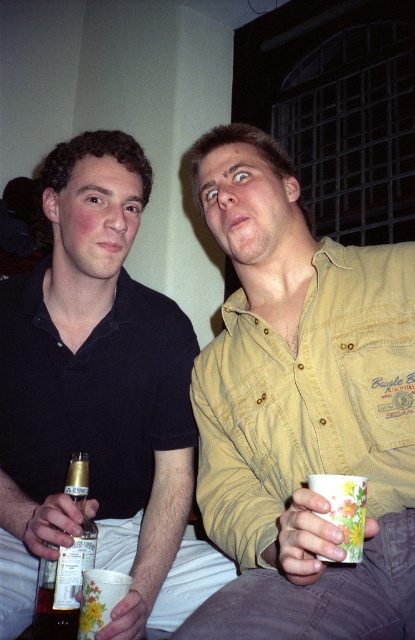
Question: Which object is farther from the camera taking this photo?

Choices:
 (A) yellow cotton shirt at upper right
 (B) gold foil beer bottle at lower left
 (C) matte black shirt at left

Answer: (B)

Question: Observing the image, what is the correct spatial positioning of matte black shirt at left in reference to gold foil beer bottle at lower left?

Choices:
 (A) above
 (B) below

Answer: (A)

Question: Does yellow cotton shirt at upper right appear on the left side of matte black shirt at left?

Choices:
 (A) no
 (B) yes

Answer: (A)

Question: Estimate the real-world distances between objects in this image. Which object is closer to the gold foil beer bottle at lower left?

Choices:
 (A) yellow cotton shirt at upper right
 (B) matte black shirt at left

Answer: (B)

Question: Can you confirm if yellow cotton shirt at upper right is positioned to the left of gold foil beer bottle at lower left?

Choices:
 (A) yes
 (B) no

Answer: (B)

Question: Based on their relative distances, which object is nearer to the gold foil beer bottle at lower left?

Choices:
 (A) matte black shirt at left
 (B) yellow cotton shirt at upper right

Answer: (A)